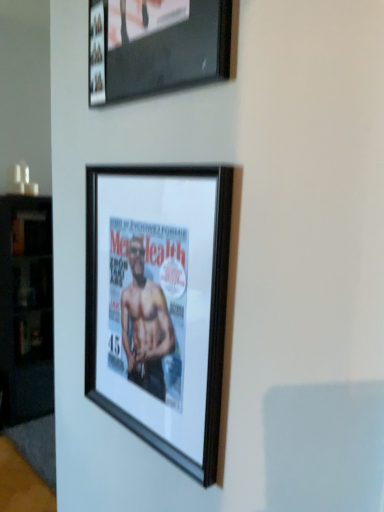
Question: In which direction should I rotate to look at black matte picture frame at center, which appears as the first picture frame when ordered from the bottom?

Choices:
 (A) right
 (B) left

Answer: (B)

Question: Is black wood cabinet at left inside matte black picture frame at upper center, which appears as the first picture frame when viewed from the top?

Choices:
 (A) yes
 (B) no

Answer: (B)

Question: Is matte black picture frame at upper center, which appears as the first picture frame when viewed from the top, shorter than black wood cabinet at left?

Choices:
 (A) no
 (B) yes

Answer: (B)

Question: Can you confirm if matte black picture frame at upper center, the second picture frame when ordered from bottom to top, is smaller than black wood cabinet at left?

Choices:
 (A) yes
 (B) no

Answer: (A)

Question: From a real-world perspective, is matte black picture frame at upper center, the second picture frame when ordered from bottom to top, under black wood cabinet at left?

Choices:
 (A) no
 (B) yes

Answer: (A)

Question: From the image's perspective, is matte black picture frame at upper center, the second picture frame when ordered from bottom to top, beneath black wood cabinet at left?

Choices:
 (A) yes
 (B) no

Answer: (B)

Question: From the image's perspective, is matte black picture frame at upper center, the second picture frame when ordered from bottom to top, over black wood cabinet at left?

Choices:
 (A) yes
 (B) no

Answer: (A)

Question: Does black matte picture frame at center, the 2th picture frame when ordered from top to bottom, have a larger size compared to matte black picture frame at upper center, the second picture frame when ordered from bottom to top?

Choices:
 (A) yes
 (B) no

Answer: (B)

Question: Is black matte picture frame at center, the 2th picture frame when ordered from top to bottom, positioned beyond the bounds of matte black picture frame at upper center, the second picture frame when ordered from bottom to top?

Choices:
 (A) no
 (B) yes

Answer: (B)

Question: Is black matte picture frame at center, the 2th picture frame when ordered from top to bottom, directly adjacent to matte black picture frame at upper center, the second picture frame when ordered from bottom to top?

Choices:
 (A) yes
 (B) no

Answer: (B)

Question: Can you confirm if black matte picture frame at center, the 2th picture frame when ordered from top to bottom, is shorter than matte black picture frame at upper center, which appears as the first picture frame when viewed from the top?

Choices:
 (A) yes
 (B) no

Answer: (B)

Question: From the image's perspective, is black matte picture frame at center, which appears as the first picture frame when ordered from the bottom, on matte black picture frame at upper center, the second picture frame when ordered from bottom to top?

Choices:
 (A) no
 (B) yes

Answer: (A)

Question: Is black matte picture frame at center, the 2th picture frame when ordered from top to bottom, aimed at matte black picture frame at upper center, the second picture frame when ordered from bottom to top?

Choices:
 (A) yes
 (B) no

Answer: (B)

Question: From the image's perspective, is black wood cabinet at left below black matte picture frame at center, the 2th picture frame when ordered from top to bottom?

Choices:
 (A) yes
 (B) no

Answer: (A)